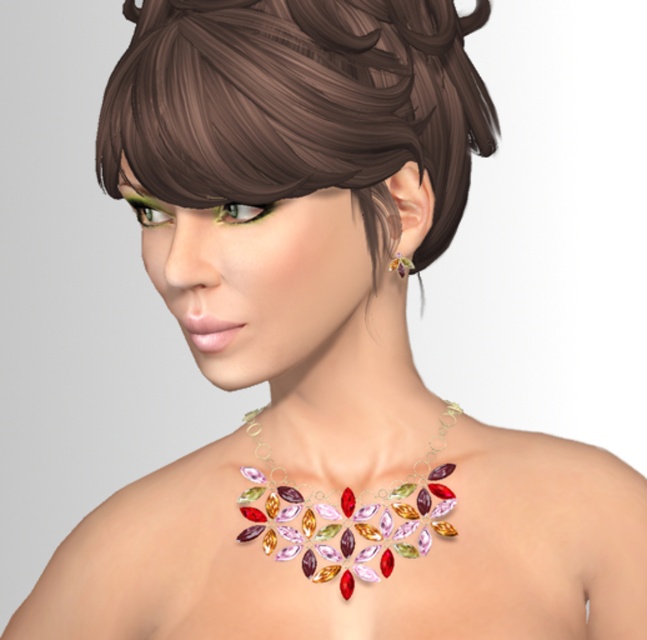
You are a jewelry designer who wants to create a matching set using the multicolored gemstone necklace at center and the shiny gold earring at ear. Which piece should you scale down in size to ensure they complement each other?

The multicolored gemstone necklace at center has a larger size compared to the shiny gold earring at ear. To create a balanced set, you should scale down the size of the multicolored gemstone necklace at center to match the smaller size of the shiny gold earring at ear.

You are a photographer adjusting the focus on your camera. You want to ensure the multicolored gemstone necklace at center is in sharp focus. Given that the camera can only focus precisely on objects at a specific coordinate, what coordinate should you set to capture the necklace clearly?

The multicolored gemstone necklace at center is positioned at coordinate point (345,515), so you should set the focus to that coordinate to capture it clearly.

You are a photographer adjusting the lighting for a closeup portrait. You notice the multicolored gemstone necklace at center and the shiny gold earring at ear. Which object is positioned more to the left side of the image?

The multicolored gemstone necklace at center is to the left of the shiny gold earring at ear, so it is positioned more to the left side of the image.